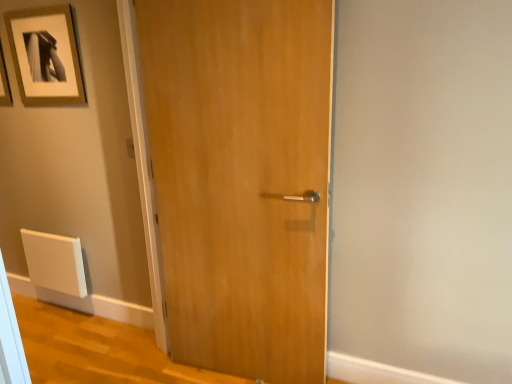
Question: Is wooden door at center outside of matte gold picture frame at upper left?

Choices:
 (A) yes
 (B) no

Answer: (A)

Question: Does wooden door at center turn towards matte gold picture frame at upper left?

Choices:
 (A) yes
 (B) no

Answer: (B)

Question: Can you confirm if wooden door at center is wider than matte gold picture frame at upper left?

Choices:
 (A) no
 (B) yes

Answer: (B)

Question: Is wooden door at center to the left of matte gold picture frame at upper left from the viewer's perspective?

Choices:
 (A) no
 (B) yes

Answer: (A)

Question: Considering the relative sizes of wooden door at center and matte gold picture frame at upper left in the image provided, is wooden door at center taller than matte gold picture frame at upper left?

Choices:
 (A) yes
 (B) no

Answer: (A)

Question: Is wooden door at center at the right side of matte gold picture frame at upper left?

Choices:
 (A) no
 (B) yes

Answer: (B)

Question: Is matte gold picture frame at upper left taller than wooden door at center?

Choices:
 (A) no
 (B) yes

Answer: (A)

Question: Can you confirm if matte gold picture frame at upper left is shorter than wooden door at center?

Choices:
 (A) yes
 (B) no

Answer: (A)

Question: Can we say matte gold picture frame at upper left lies outside wooden door at center?

Choices:
 (A) yes
 (B) no

Answer: (A)

Question: Considering the relative sizes of matte gold picture frame at upper left and wooden door at center in the image provided, is matte gold picture frame at upper left bigger than wooden door at center?

Choices:
 (A) yes
 (B) no

Answer: (B)

Question: Does matte gold picture frame at upper left have a lesser width compared to wooden door at center?

Choices:
 (A) yes
 (B) no

Answer: (A)

Question: From the image's perspective, does matte gold picture frame at upper left appear lower than wooden door at center?

Choices:
 (A) no
 (B) yes

Answer: (A)

Question: Looking at the image, does matte gold picture frame at upper left seem bigger or smaller compared to wooden door at center?

Choices:
 (A) big
 (B) small

Answer: (B)